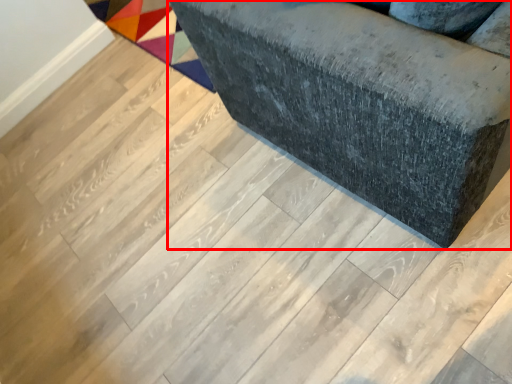
Question: Observing the image, what is the correct spatial positioning of furniture (annotated by the red box) in reference to mat?

Choices:
 (A) right
 (B) left

Answer: (A)